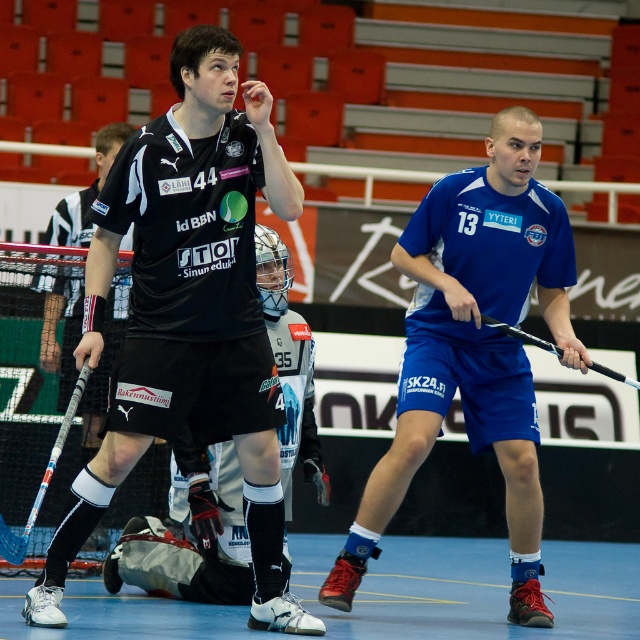
What are the coordinates of the black matte jersey at center?

The coordinates of the black matte jersey at center are at point [188,310].

What is located at the coordinates point (474, 346) in the image?

The blue fabric shorts at center are located at point (474, 346).